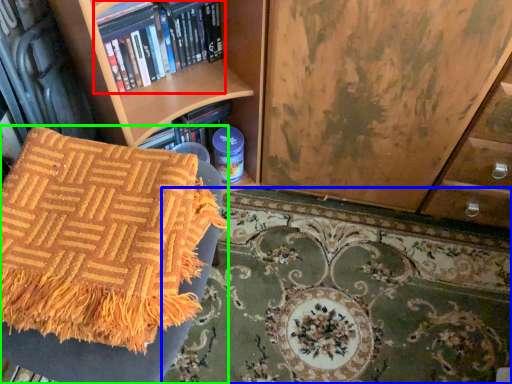
Question: Considering the real-world distances, which object is closest to book (highlighted by a red box)? mat (highlighted by a blue box) or furniture (highlighted by a green box).

Choices:
 (A) mat
 (B) furniture

Answer: (B)